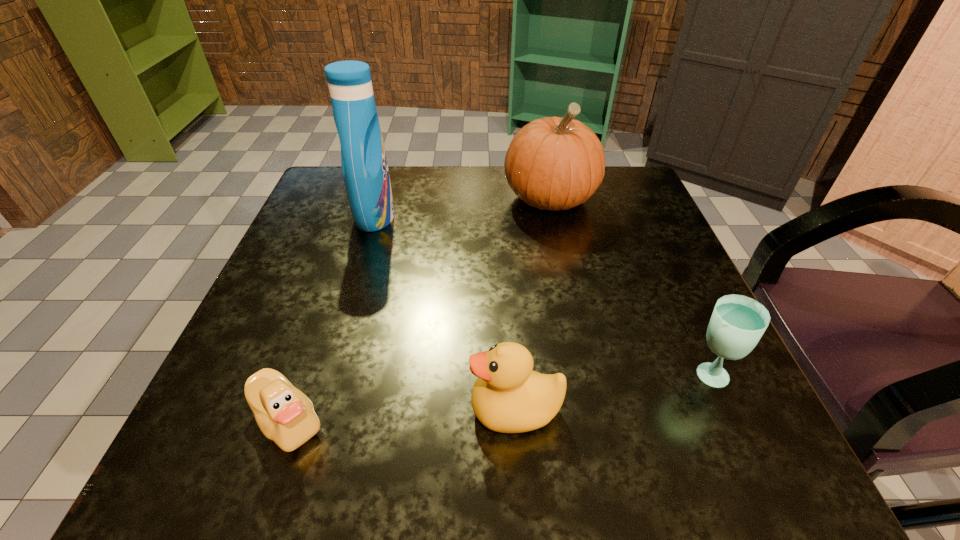
What are the coordinates of `object situated at the far right corner` in the screenshot? It's located at (554, 163).

In the image, there is a desktop. Where is `free region at the far edge`? The width and height of the screenshot is (960, 540). free region at the far edge is located at coordinates (509, 202).

Locate an element on the screen. The height and width of the screenshot is (540, 960). vacant region at the near edge is located at coordinates (559, 472).

The image size is (960, 540). Find the location of `vacant area at the left edge`. vacant area at the left edge is located at coordinates (286, 255).

The width and height of the screenshot is (960, 540). What are the coordinates of `vacant space at the right edge of the desktop` in the screenshot? It's located at (653, 383).

Locate an element on the screen. This screenshot has height=540, width=960. blank space at the near left corner of the desktop is located at coordinates 193,432.

This screenshot has width=960, height=540. Find the location of `vacant space at the near right corner`. vacant space at the near right corner is located at coordinates (686, 414).

The width and height of the screenshot is (960, 540). Find the location of `blank region between the detergent and the rightmost object`. blank region between the detergent and the rightmost object is located at coordinates (540, 295).

This screenshot has width=960, height=540. In order to click on vacant space that's between the fourth shortest object and the right duck in this screenshot , I will do `click(533, 304)`.

I want to click on free area in between the rightmost object and the right duck, so click(612, 392).